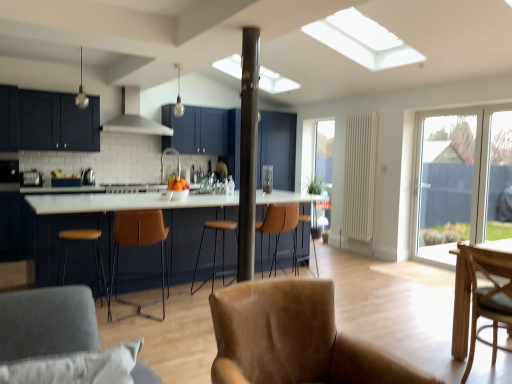
Question: Considering the relative positions of transparent glass door at right and satin silver stove at center in the image provided, is transparent glass door at right to the left of satin silver stove at center from the viewer's perspective?

Choices:
 (A) no
 (B) yes

Answer: (A)

Question: Is transparent glass door at right shorter than satin silver stove at center?

Choices:
 (A) no
 (B) yes

Answer: (A)

Question: From the image's perspective, would you say transparent glass door at right is shown under satin silver stove at center?

Choices:
 (A) yes
 (B) no

Answer: (A)

Question: Considering the relative sizes of transparent glass door at right and satin silver stove at center in the image provided, is transparent glass door at right wider than satin silver stove at center?

Choices:
 (A) no
 (B) yes

Answer: (A)

Question: Considering the relative sizes of transparent glass door at right and satin silver stove at center in the image provided, is transparent glass door at right bigger than satin silver stove at center?

Choices:
 (A) yes
 (B) no

Answer: (A)

Question: Considering the relative positions of transparent glass door at right and metallic pole at center in the image provided, is transparent glass door at right to the left or to the right of metallic pole at center?

Choices:
 (A) left
 (B) right

Answer: (B)

Question: In terms of width, does transparent glass door at right look wider or thinner when compared to metallic pole at center?

Choices:
 (A) thin
 (B) wide

Answer: (A)

Question: From the image's perspective, relative to metallic pole at center, is transparent glass door at right above or below?

Choices:
 (A) above
 (B) below

Answer: (B)

Question: From a real-world perspective, is transparent glass door at right positioned above or below metallic pole at center?

Choices:
 (A) above
 (B) below

Answer: (B)

Question: Is brown leather bar stool at center, the first bar stool positioned from the back, in front of or behind brown leather bar stool at center, marked as the second bar stool in a front-to-back arrangement, in the image?

Choices:
 (A) front
 (B) behind

Answer: (B)

Question: Looking at their shapes, would you say brown leather bar stool at center, the 3th bar stool from the left, is wider or thinner than brown leather bar stool at center, arranged as the second bar stool when viewed from the back?

Choices:
 (A) wide
 (B) thin

Answer: (B)

Question: Considering the positions of brown leather bar stool at center, the 3th bar stool from the left, and brown leather bar stool at center, acting as the 2th bar stool starting from the right, in the image, is brown leather bar stool at center, the 3th bar stool from the left, bigger or smaller than brown leather bar stool at center, acting as the 2th bar stool starting from the right,?

Choices:
 (A) big
 (B) small

Answer: (B)

Question: Is brown leather bar stool at center, the 3th bar stool from the left, to the left or to the right of brown leather bar stool at center, marked as the second bar stool in a front-to-back arrangement, in the image?

Choices:
 (A) left
 (B) right

Answer: (B)

Question: Is satin silver toaster at left, arranged as the 3th appliance when viewed from the right, to the left or to the right of metallic glass at center, the 3th appliance positioned from the left, in the image?

Choices:
 (A) left
 (B) right

Answer: (A)

Question: From the image's perspective, is satin silver toaster at left, which is the 1th appliance in left-to-right order, located above or below metallic glass at center, the 3th appliance positioned from the left?

Choices:
 (A) above
 (B) below

Answer: (A)